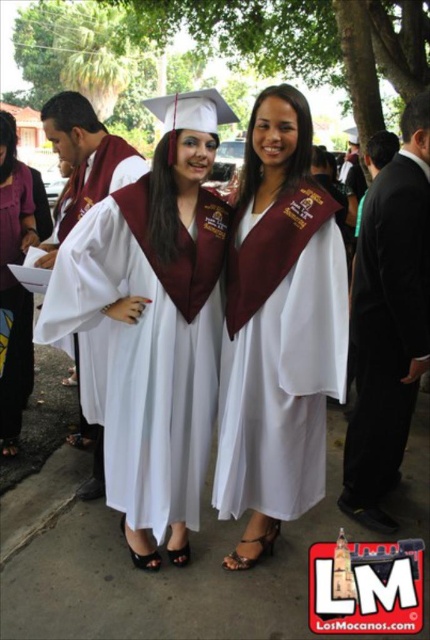
You are a photographer at a graduation ceremony. You need to capture a photo of both the white matte graduation gown at center and the white satin gown at center. Which gown should you focus on first if you want to ensure both are fully visible in the frame?

The white matte graduation gown at center is bigger than the white satin gown at center, so you should focus on the white matte graduation gown at center first to ensure it fits in the frame, then adjust to include the smaller white satin gown at center.

You are a photographer at a graduation ceremony. You need to capture a photo of both the white matte graduation gown at center and the white satin gown at center. Which gown should you focus on first to ensure both are in the frame?

You should focus on the white matte graduation gown at center first because it is closer to you than the white satin gown at center, ensuring both will be in the frame when properly adjusted.